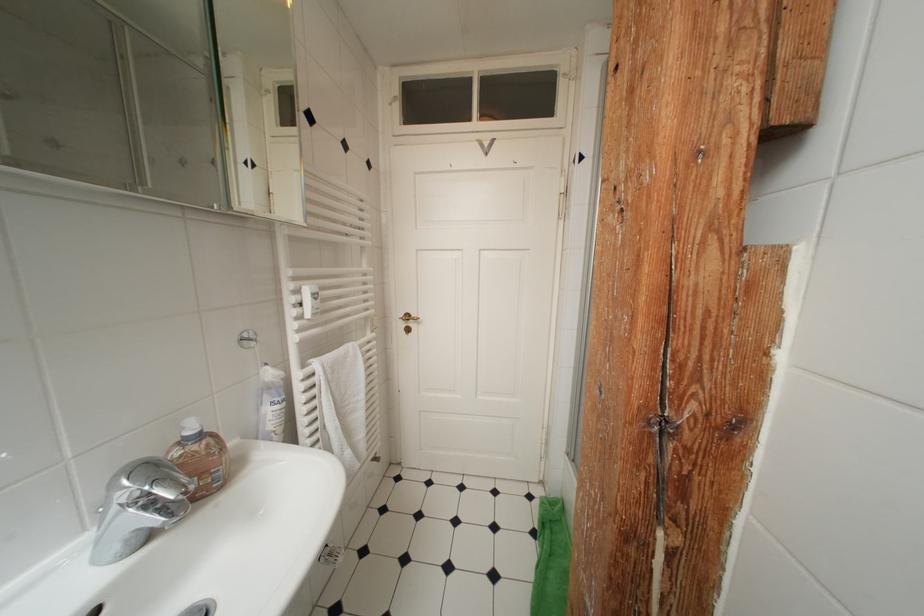
Image resolution: width=924 pixels, height=616 pixels. I want to click on cabinet mirror door, so click(x=259, y=106).